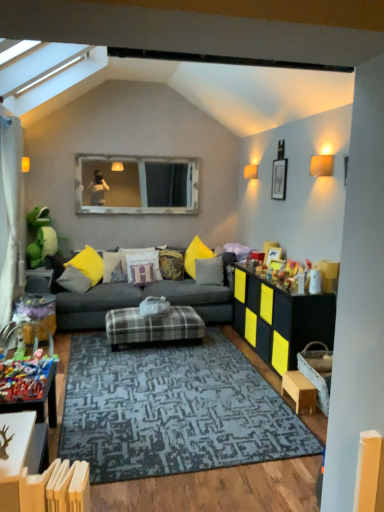
Question: From the image's perspective, relative to purple velvet pillow at center, placed as the 3th pillow when sorted from right to left, is wooden-framed mirror at upper center above or below?

Choices:
 (A) above
 (B) below

Answer: (A)

Question: From a real-world perspective, is wooden-framed mirror at upper center above or below purple velvet pillow at center, which is counted as the 4th pillow, starting from the left?

Choices:
 (A) below
 (B) above

Answer: (B)

Question: Estimate the real-world distances between objects in this image. Which object is closer to the velvet yellow pillow at center, arranged as the third pillow when viewed from the left?

Choices:
 (A) wooden table at lower left, the 4th table positioned from the right
 (B) wooden-framed mirror at upper center
 (C) plastic toy at lower left, the 1th toy positioned from the front
 (D) textured yellow pillow at center, which is counted as the second pillow, starting from the right
 (E) plaid fabric ottoman at center, placed as the 2th table when sorted from left to right

Answer: (D)

Question: Which of these objects is positioned farthest from the plastic toy at lower left, which is the second toy from top to bottom?

Choices:
 (A) matte gray fabric couch at center
 (B) green plush toy at left, which ranks as the first toy in back-to-front order
 (C) wooden-framed mirror at upper center
 (D) wooden table at lower left, the 4th table positioned from the right
 (E) velvet yellow pillow at center, the fourth pillow from the right

Answer: (C)